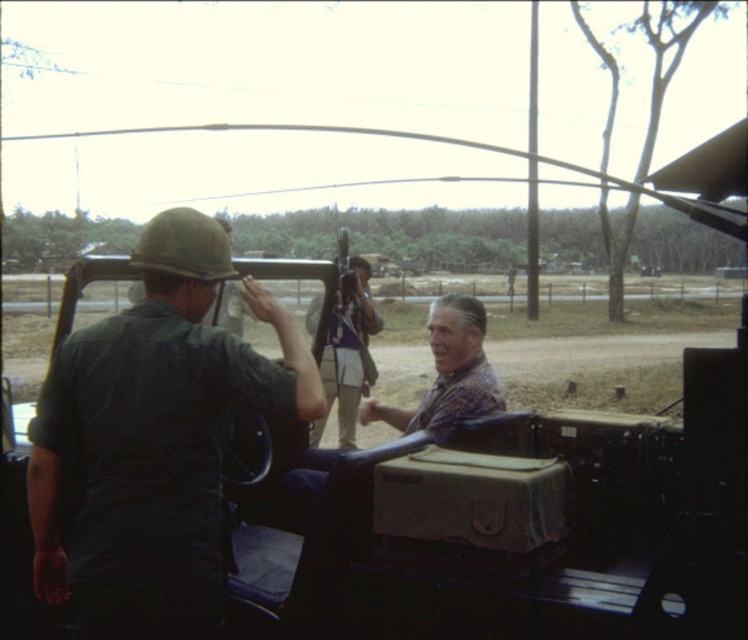
Who is more distant from viewer, [470,337] or [349,324]?

Positioned behind is point [349,324].

Is plaid fabric shirt at center further to camera compared to camouflage fabric rifle at center?

No, plaid fabric shirt at center is in front of camouflage fabric rifle at center.

Is point (435, 406) positioned in front of point (358, 378)?

That is True.

Locate an element on the screen. plaid fabric shirt at center is located at coordinates (447, 372).

Does dark green uniform at left appear under plaid fabric shirt at center?

Indeed, dark green uniform at left is positioned under plaid fabric shirt at center.

Is point (52, 508) less distant than point (453, 339)?

Yes, point (52, 508) is in front of point (453, 339).

This screenshot has width=748, height=640. I want to click on dark green uniform at left, so [x=153, y=440].

Does dark green uniform at left appear over camouflage fabric rifle at center?

No, dark green uniform at left is not above camouflage fabric rifle at center.

Is point (105, 403) closer to viewer compared to point (319, 305)?

Yes, point (105, 403) is in front of point (319, 305).

The height and width of the screenshot is (640, 748). I want to click on dark green uniform at left, so click(x=153, y=440).

I want to click on dark green uniform at left, so click(153, 440).